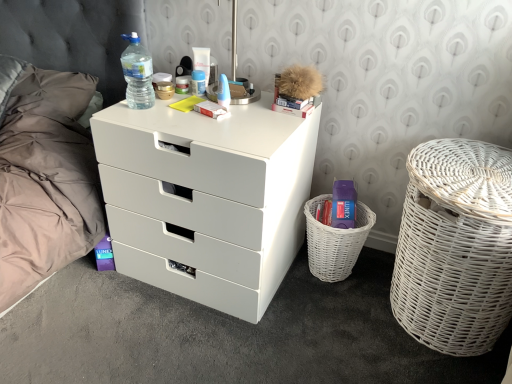
Find the location of a particular element. vacant area that is in front of white wicker basket at lower right is located at coordinates (334, 312).